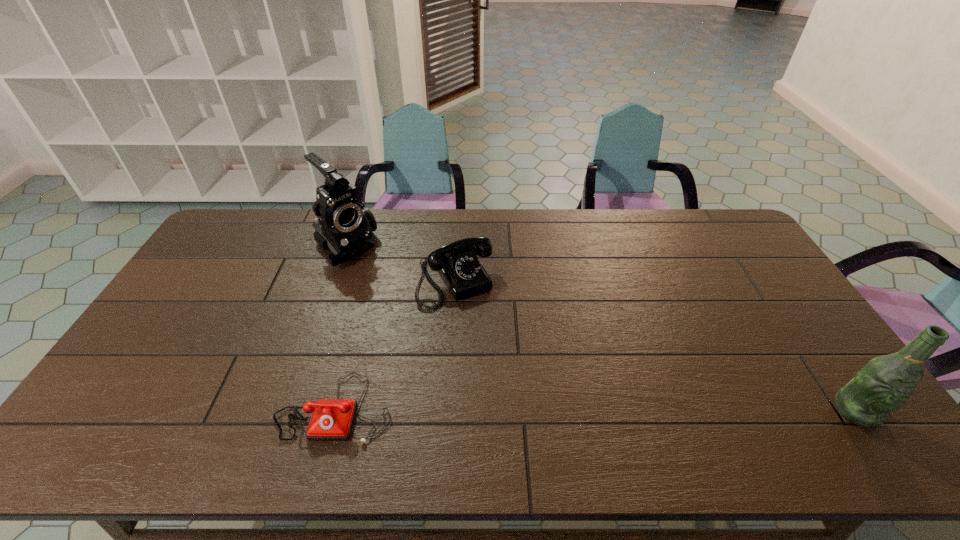
The width and height of the screenshot is (960, 540). I want to click on vacant space located on the lens mount of the camcorder, so click(x=386, y=288).

You are a GUI agent. You are given a task and a screenshot of the screen. Output one action in this format:
    pyautogui.click(x=<x>, y=<y>)
    Task: Click on the free space located on the lens mount of the camcorder
    
    Given the screenshot: What is the action you would take?
    pyautogui.click(x=402, y=303)

The image size is (960, 540). I want to click on object situated at the far edge, so click(345, 226).

Locate an element on the screen. telephone located in the near edge section of the desktop is located at coordinates (332, 419).

Image resolution: width=960 pixels, height=540 pixels. I want to click on beer bottle located at the near edge, so click(x=885, y=383).

The height and width of the screenshot is (540, 960). I want to click on object positioned at the right edge, so click(x=885, y=383).

Image resolution: width=960 pixels, height=540 pixels. What are the coordinates of `object positioned at the near right corner` in the screenshot? It's located at coord(885,383).

Find the location of a particular element. The width and height of the screenshot is (960, 540). free region at the far edge is located at coordinates (454, 239).

The width and height of the screenshot is (960, 540). Identify the location of vacant space at the near edge of the desktop. (199, 400).

In the image, there is a desktop. Identify the location of vacant space at the left edge. (210, 288).